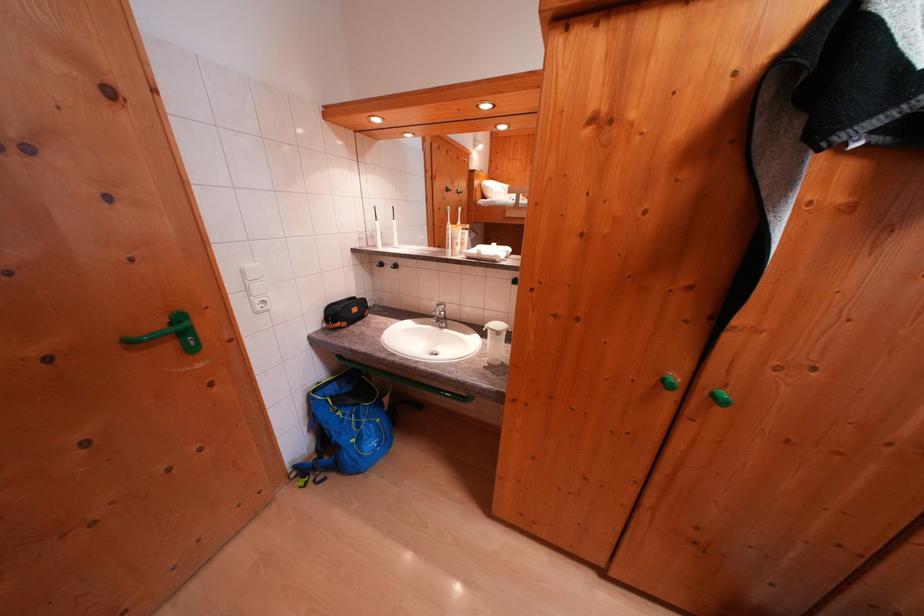
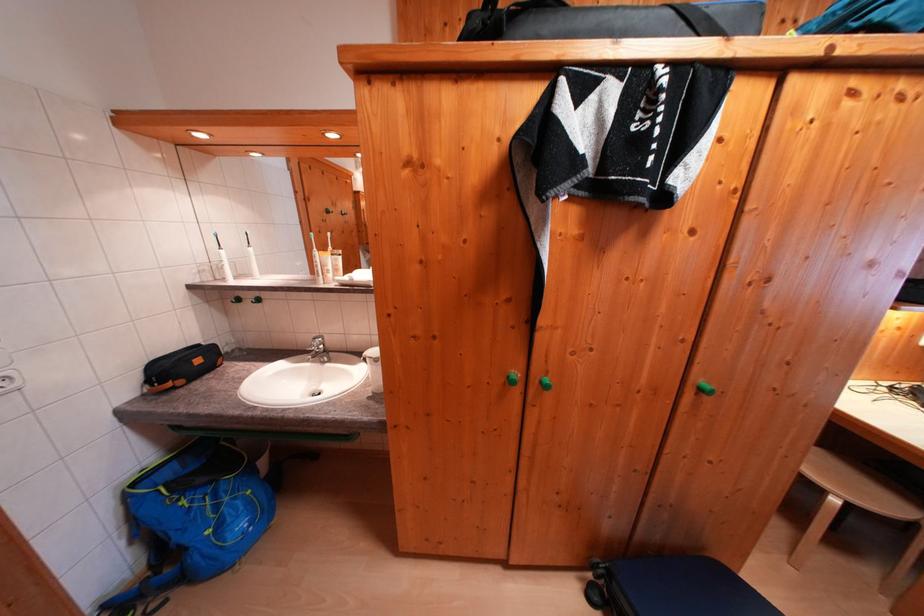
Where in the second image is the point corresponding to the point at 388,410 from the first image?

(262, 476)